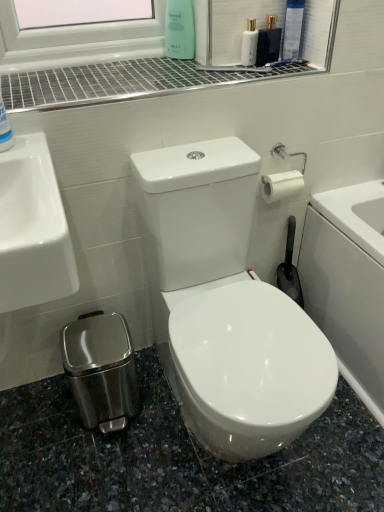
Question: From the image's perspective, does blue glossy bottle at upper left, which is counted as the second cleaning product, starting from the top, appear higher than green matte bottle at upper center, which appears as the 1th cleaning product when viewed from the top?

Choices:
 (A) no
 (B) yes

Answer: (A)

Question: From the image's perspective, is blue glossy bottle at upper left, positioned as the 2th cleaning product in right-to-left order, below green matte bottle at upper center, which is the 2th cleaning product from left to right?

Choices:
 (A) no
 (B) yes

Answer: (B)

Question: Considering the relative positions of blue glossy bottle at upper left, positioned as the 2th cleaning product in right-to-left order, and green matte bottle at upper center, which appears as the 1th cleaning product when viewed from the top, in the image provided, is blue glossy bottle at upper left, positioned as the 2th cleaning product in right-to-left order, to the left of green matte bottle at upper center, which appears as the 1th cleaning product when viewed from the top, from the viewer's perspective?

Choices:
 (A) yes
 (B) no

Answer: (A)

Question: Considering the relative sizes of blue glossy bottle at upper left, placed as the 1th cleaning product when sorted from left to right, and green matte bottle at upper center, which appears as the 1th cleaning product when viewed from the top, in the image provided, is blue glossy bottle at upper left, placed as the 1th cleaning product when sorted from left to right, bigger than green matte bottle at upper center, which appears as the 1th cleaning product when viewed from the top,?

Choices:
 (A) no
 (B) yes

Answer: (B)

Question: Could you tell me if blue glossy bottle at upper left, positioned as the first cleaning product in bottom-to-top order, is turned towards green matte bottle at upper center, which appears as the 1th cleaning product when viewed from the top?

Choices:
 (A) no
 (B) yes

Answer: (A)

Question: Considering the positions of white glossy toilet at center and white glossy mouthwash at upper center in the image, is white glossy toilet at center wider or thinner than white glossy mouthwash at upper center?

Choices:
 (A) thin
 (B) wide

Answer: (B)

Question: From a real-world perspective, is white glossy toilet at center above or below white glossy mouthwash at upper center?

Choices:
 (A) above
 (B) below

Answer: (B)

Question: In the image, is white glossy toilet at center on the left side or the right side of white glossy mouthwash at upper center?

Choices:
 (A) right
 (B) left

Answer: (B)

Question: Is white glossy toilet at center bigger or smaller than white glossy mouthwash at upper center?

Choices:
 (A) big
 (B) small

Answer: (A)

Question: Is blue glossy bottle at upper left, which is counted as the second cleaning product, starting from the top, spatially inside white glossy mouthwash at upper center, or outside of it?

Choices:
 (A) inside
 (B) outside

Answer: (B)

Question: Is blue glossy bottle at upper left, which appears as the 2th cleaning product when viewed from the back, in front of or behind white glossy mouthwash at upper center in the image?

Choices:
 (A) front
 (B) behind

Answer: (A)

Question: In the image, is blue glossy bottle at upper left, placed as the 1th cleaning product when sorted from left to right, on the left side or the right side of white glossy mouthwash at upper center?

Choices:
 (A) right
 (B) left

Answer: (B)

Question: In terms of width, does blue glossy bottle at upper left, positioned as the first cleaning product in bottom-to-top order, look wider or thinner when compared to white glossy mouthwash at upper center?

Choices:
 (A) wide
 (B) thin

Answer: (A)

Question: Is green matte bottle at upper center, which ranks as the 2th cleaning product in bottom-to-top order, taller or shorter than blue glossy bottle at upper left, positioned as the 2th cleaning product in right-to-left order?

Choices:
 (A) short
 (B) tall

Answer: (B)

Question: In terms of size, does green matte bottle at upper center, which is the 2th cleaning product from left to right, appear bigger or smaller than blue glossy bottle at upper left, positioned as the first cleaning product in bottom-to-top order?

Choices:
 (A) small
 (B) big

Answer: (A)